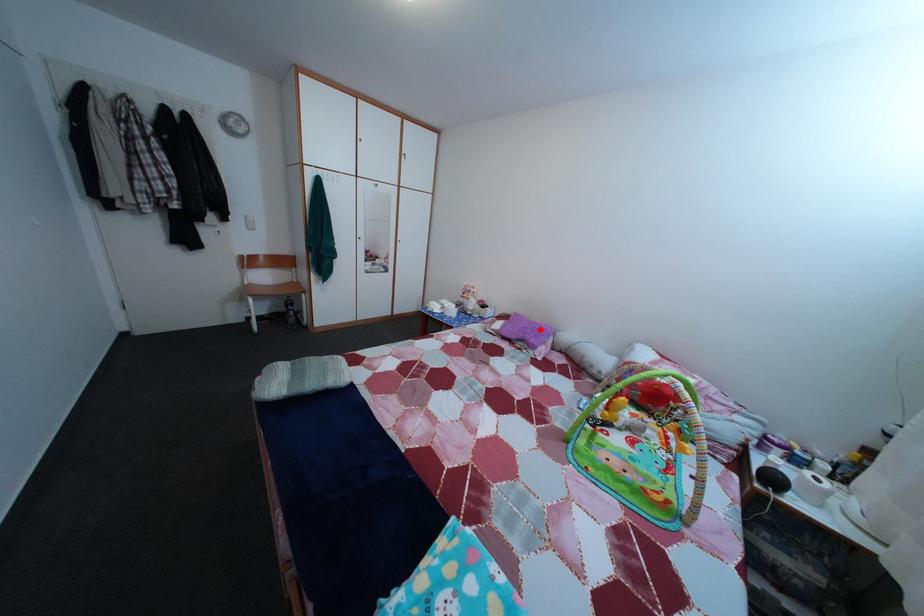
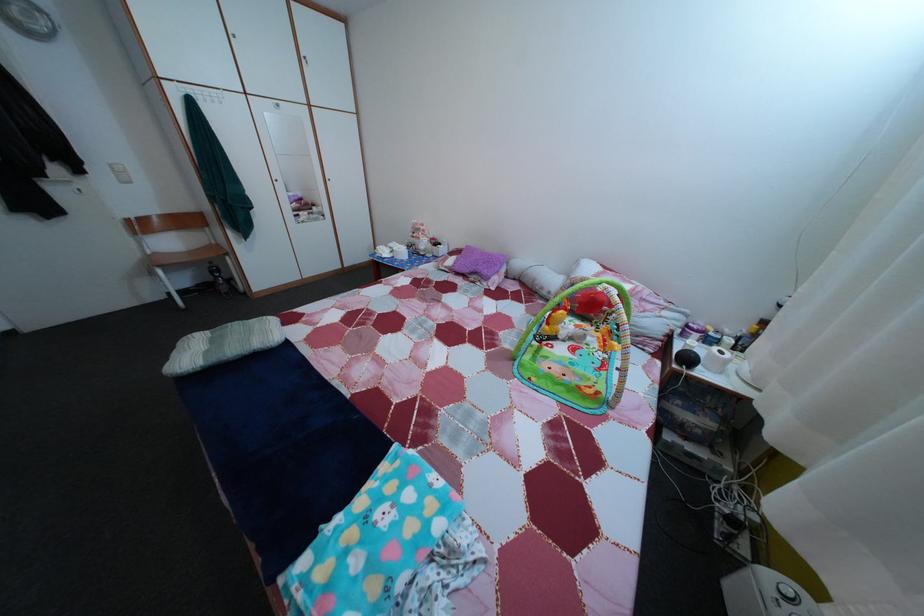
In the second image, find the point that corresponds to the highlighted location in the first image.

(492, 261)